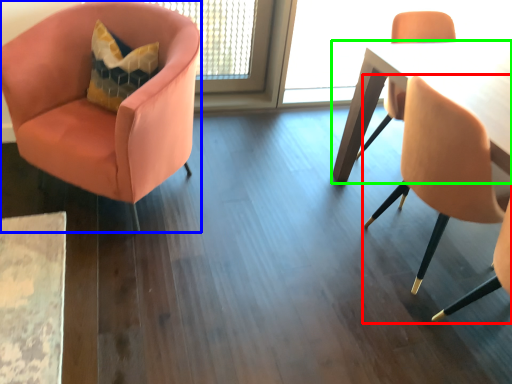
Question: Estimate the real-world distances between objects in this image. Which object is closer to chair (highlighted by a red box), chair (highlighted by a blue box) or table (highlighted by a green box)?

Choices:
 (A) chair
 (B) table

Answer: (B)